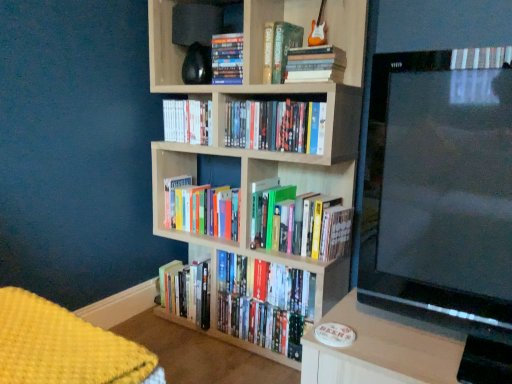
Identify the location of free space above hardcover books at center, which is the fourth book in bottom-to-top order (from a real-world perspective). This screenshot has height=384, width=512. (267, 100).